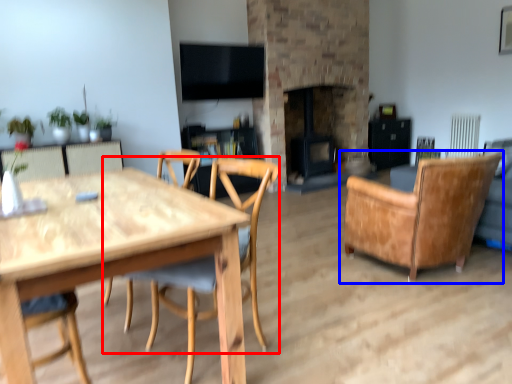
Question: Which of the following is the farthest to the observer, chair (highlighted by a red box) or chair (highlighted by a blue box)?

Choices:
 (A) chair
 (B) chair

Answer: (B)